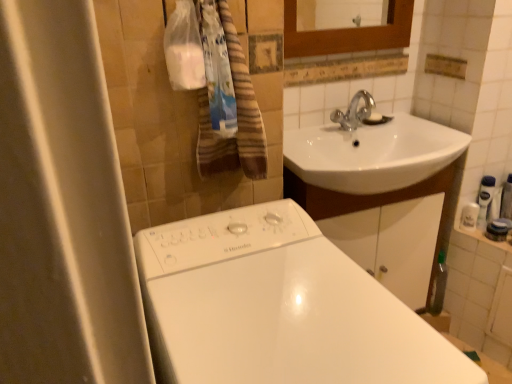
Question: From a real-world perspective, is white glossy bathtub at lower center located beneath brown striped towel at upper left?

Choices:
 (A) yes
 (B) no

Answer: (A)

Question: From the image's perspective, is white glossy bathtub at lower center located above brown striped towel at upper left?

Choices:
 (A) no
 (B) yes

Answer: (A)

Question: Is white glossy bathtub at lower center not near brown striped towel at upper left?

Choices:
 (A) no
 (B) yes

Answer: (A)

Question: Can you confirm if white glossy bathtub at lower center is thinner than brown striped towel at upper left?

Choices:
 (A) yes
 (B) no

Answer: (B)

Question: Considering the relative sizes of white glossy bathtub at lower center and brown striped towel at upper left in the image provided, is white glossy bathtub at lower center shorter than brown striped towel at upper left?

Choices:
 (A) yes
 (B) no

Answer: (B)

Question: Is brown striped towel at upper left wider or thinner than white glossy lotion at right, placed as the 2th toiletry when sorted from left to right?

Choices:
 (A) wide
 (B) thin

Answer: (A)

Question: From the image's perspective, is brown striped towel at upper left positioned above or below white glossy lotion at right, the first toiletry viewed from the right?

Choices:
 (A) above
 (B) below

Answer: (A)

Question: From a real-world perspective, is brown striped towel at upper left physically located above or below white glossy lotion at right, placed as the 2th toiletry when sorted from left to right?

Choices:
 (A) above
 (B) below

Answer: (A)

Question: In terms of size, does brown striped towel at upper left appear bigger or smaller than white glossy lotion at right, placed as the 2th toiletry when sorted from left to right?

Choices:
 (A) small
 (B) big

Answer: (B)

Question: Considering the positions of white glossy bathtub at lower center and brown striped towel at upper left in the image, is white glossy bathtub at lower center wider or thinner than brown striped towel at upper left?

Choices:
 (A) wide
 (B) thin

Answer: (A)

Question: From their relative heights in the image, would you say white glossy bathtub at lower center is taller or shorter than brown striped towel at upper left?

Choices:
 (A) tall
 (B) short

Answer: (A)

Question: From the image's perspective, relative to brown striped towel at upper left, is white glossy bathtub at lower center above or below?

Choices:
 (A) below
 (B) above

Answer: (A)

Question: Looking at the image, does white glossy bathtub at lower center seem bigger or smaller compared to brown striped towel at upper left?

Choices:
 (A) big
 (B) small

Answer: (A)

Question: Looking at the image, does white plastic soap dispenser at right, acting as the first toiletry starting from the left, seem bigger or smaller compared to white glossy bathtub at lower center?

Choices:
 (A) small
 (B) big

Answer: (A)

Question: Would you say white plastic soap dispenser at right, which is the 2th toiletry from right to left, is inside or outside white glossy bathtub at lower center?

Choices:
 (A) outside
 (B) inside

Answer: (A)